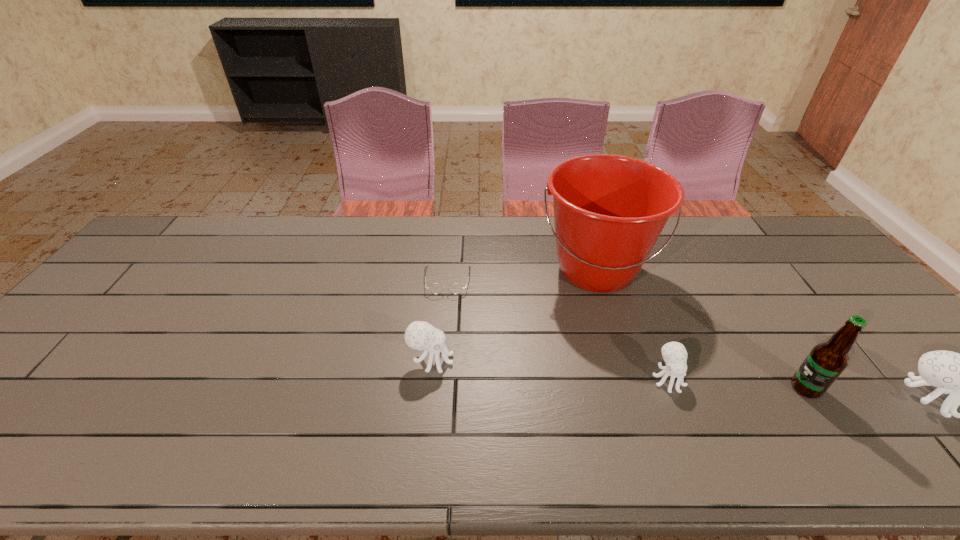
The image size is (960, 540). In order to click on vacant space at the right edge in this screenshot , I will do `click(835, 320)`.

At what (x,y) coordinates should I click in order to perform the action: click on free space at the near left corner of the desktop. Please return your answer as a coordinate pair (x, y). Image resolution: width=960 pixels, height=540 pixels. Looking at the image, I should click on (60, 392).

In the image, there is a desktop. Where is `vacant space at the far right corner`? vacant space at the far right corner is located at coordinates (806, 241).

Where is `vacant area between the beer bottle and the shortest octopus`? vacant area between the beer bottle and the shortest octopus is located at coordinates (737, 383).

Locate an element on the screen. free space between the shortest octopus and the beer bottle is located at coordinates (737, 383).

In order to click on empty space that is in between the fifth shortest object and the tallest object in this screenshot , I will do `click(701, 329)`.

Identify the location of unoccupied area between the second tallest object and the bucket. (701, 329).

Find the location of a particular element. This screenshot has height=540, width=960. free point between the bucket and the second shortest object is located at coordinates (632, 325).

The image size is (960, 540). In order to click on the fifth closest object to the spectacles in this screenshot , I will do `click(958, 374)`.

Where is `object that is the fourth closest to the rightmost object`? The height and width of the screenshot is (540, 960). object that is the fourth closest to the rightmost object is located at coordinates (419, 335).